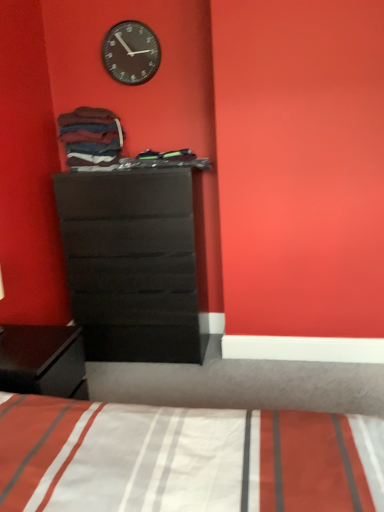
Question: Is black matte clock at upper center inside or outside of matte black dresser at center?

Choices:
 (A) outside
 (B) inside

Answer: (A)

Question: Is black matte clock at upper center wider or thinner than matte black dresser at center?

Choices:
 (A) wide
 (B) thin

Answer: (B)

Question: Considering the real-world distances, which object is farthest from the black matte clock at upper center?

Choices:
 (A) dark brown cotton socks at upper left
 (B) matte black dresser at center

Answer: (B)

Question: Which of these objects is positioned closest to the matte black dresser at center?

Choices:
 (A) dark brown cotton socks at upper left
 (B) black matte clock at upper center

Answer: (A)